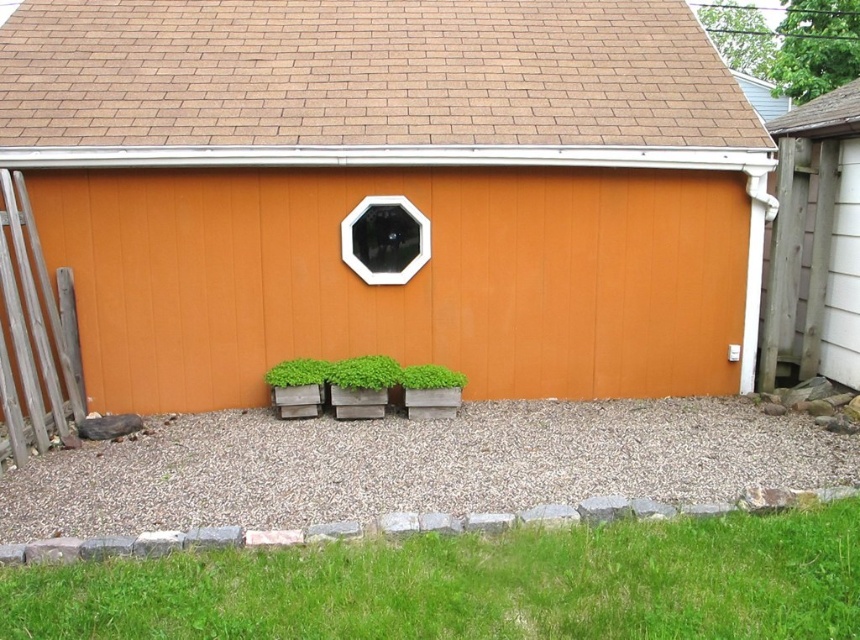
In the scene shown: You are standing in front of the building and want to walk towards the green grass at lower center. Which direction should you walk to avoid the weathered wood fence at left?

The green grass at lower center is in front of the weathered wood fence at left, so you should walk towards the green grass at lower center directly ahead rather than towards the left where the weathered wood fence at left is located.

You are a gardener planning to mow the green grass at lower center and trim the weathered wood fence at left. Which area requires more attention in terms of size?

The weathered wood fence at left is larger than the green grass at lower center, so the fence requires more attention in terms of size.